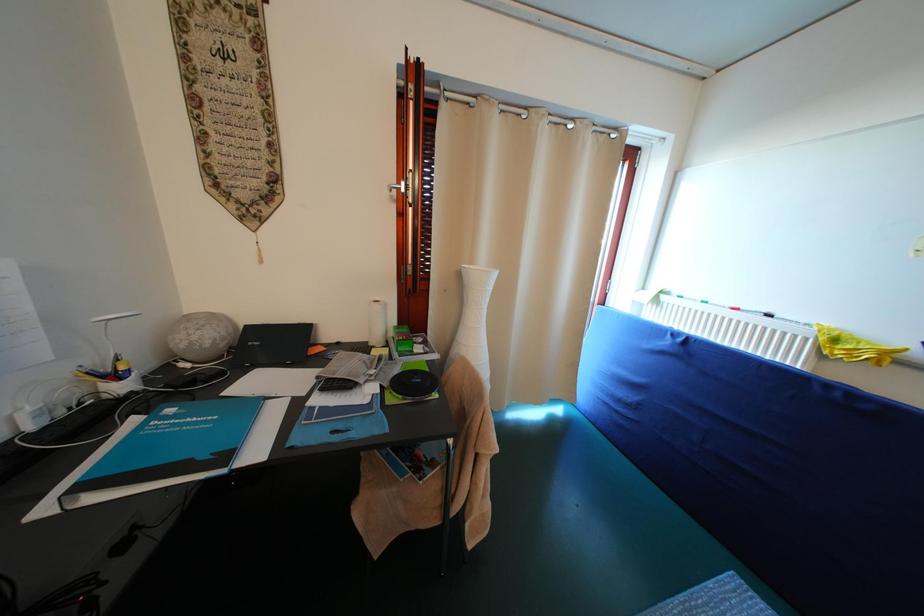
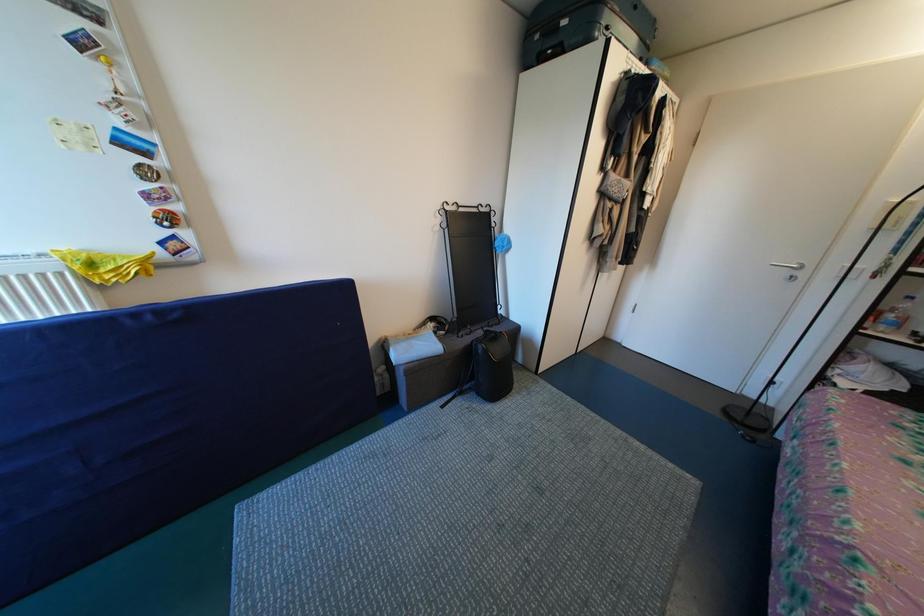
First-person continuous shooting, in which direction is the camera rotating?

The camera's rotation is toward right-down.